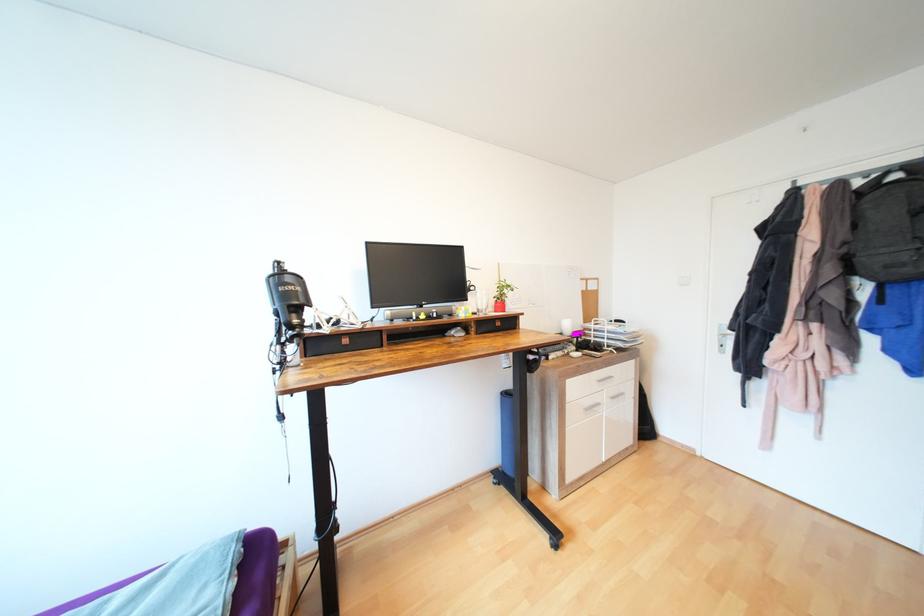
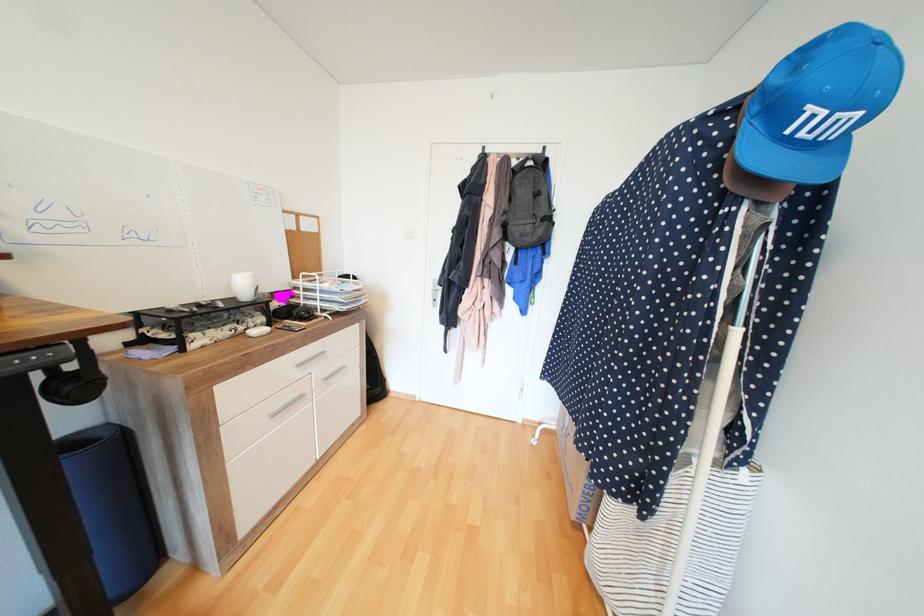
Find the pixel in the second image that matches pixel 599 339 in the first image.

(308, 302)